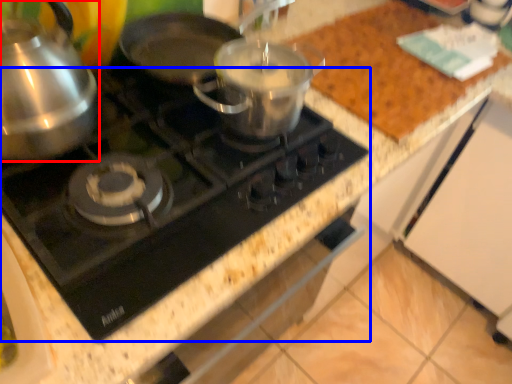
Question: Which of the following is the closest to the observer, kitchen appliance (highlighted by a red box) or gas stove (highlighted by a blue box)?

Choices:
 (A) kitchen appliance
 (B) gas stove

Answer: (A)